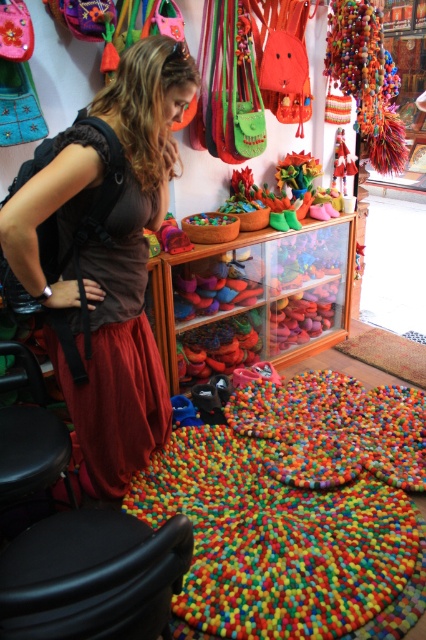
Who is more forward, (106, 564) or (20, 449)?

Point (106, 564) is more forward.

Find the location of a particular element. The height and width of the screenshot is (640, 426). black plastic stool at lower left is located at coordinates (92, 577).

Is brown fabric skirt at center further to the viewer compared to black plastic stool at lower left?

Yes.

Is brown fabric skirt at center positioned in front of black plastic stool at lower left?

No, it is not.

At what (x,y) coordinates should I click in order to perform the action: click on brown fabric skirt at center. Please return your answer as a coordinate pair (x, y). Looking at the image, I should click on (106, 257).

The image size is (426, 640). Identify the location of brown fabric skirt at center. (106, 257).

Is brown fabric skirt at center bigger than black leather stool at lower left?

Correct, brown fabric skirt at center is larger in size than black leather stool at lower left.

Is point (108, 164) positioned in front of point (69, 454)?

Yes, it is in front of point (69, 454).

Does point (78, 164) come closer to viewer compared to point (0, 440)?

Yes.

Locate an element on the screen. The height and width of the screenshot is (640, 426). brown fabric skirt at center is located at coordinates (106, 257).